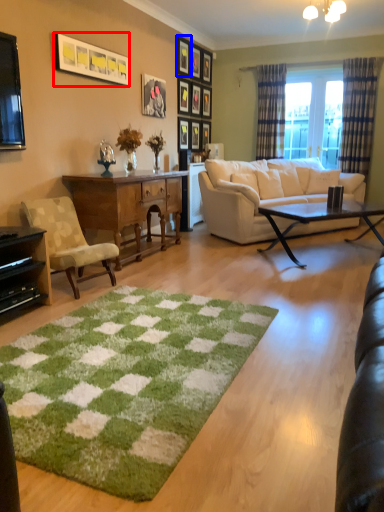
Question: Among these objects, which one is nearest to the camera, picture frame (highlighted by a red box) or picture frame (highlighted by a blue box)?

Choices:
 (A) picture frame
 (B) picture frame

Answer: (A)